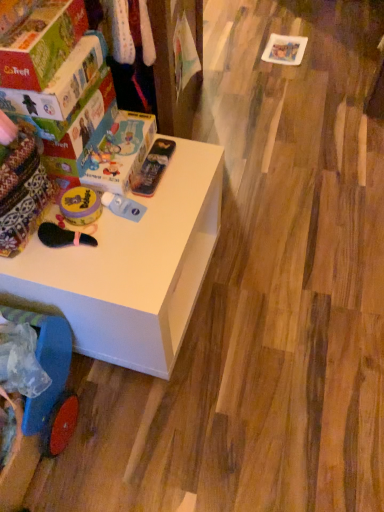
Question: Is metallic blue pencil case at upper center, which is the 1th toy in right-to-left order, a part of matte cardboard box at upper left, the 2th box positioned from the back?

Choices:
 (A) no
 (B) yes

Answer: (A)

Question: Is matte cardboard box at upper left, the 2th box positioned from the back, outside of metallic blue pencil case at upper center, which is the 1th toy in right-to-left order?

Choices:
 (A) yes
 (B) no

Answer: (A)

Question: Can you confirm if matte cardboard box at upper left, the 2th box positioned from the back, is positioned to the right of metallic blue pencil case at upper center, which is the 1th toy in right-to-left order?

Choices:
 (A) no
 (B) yes

Answer: (A)

Question: Is matte cardboard box at upper left, the 2th box positioned from the back, facing towards metallic blue pencil case at upper center, the third toy from the left?

Choices:
 (A) no
 (B) yes

Answer: (A)

Question: From the image's perspective, is matte cardboard box at upper left, which is counted as the first box, starting from the front, located above metallic blue pencil case at upper center, which is the 1th toy in right-to-left order?

Choices:
 (A) no
 (B) yes

Answer: (B)

Question: Is matte cardboard box at upper left, the 2th box positioned from the back, thinner than metallic blue pencil case at upper center, which is the 1th toy in right-to-left order?

Choices:
 (A) no
 (B) yes

Answer: (A)

Question: Is matte cardboard box at upper left, which is counted as the first box, starting from the front, completely or partially inside matte cardboard box at upper left, arranged as the second box when viewed from the front?

Choices:
 (A) yes
 (B) no

Answer: (B)

Question: From the image's perspective, is matte cardboard box at upper left, the first box from the back, on top of matte cardboard box at upper left, the 2th box positioned from the back?

Choices:
 (A) no
 (B) yes

Answer: (A)

Question: Can you confirm if matte cardboard box at upper left, arranged as the second box when viewed from the front, is taller than matte cardboard box at upper left, which is counted as the first box, starting from the front?

Choices:
 (A) yes
 (B) no

Answer: (B)

Question: Considering the relative sizes of matte cardboard box at upper left, the first box from the back, and matte cardboard box at upper left, the 2th box positioned from the back, in the image provided, is matte cardboard box at upper left, the first box from the back, thinner than matte cardboard box at upper left, the 2th box positioned from the back,?

Choices:
 (A) yes
 (B) no

Answer: (B)

Question: From the image's perspective, is matte cardboard box at upper left, arranged as the second box when viewed from the front, located beneath matte cardboard box at upper left, which is counted as the first box, starting from the front?

Choices:
 (A) yes
 (B) no

Answer: (A)

Question: Is matte cardboard box at upper left, the first box from the back, oriented away from matte cardboard box at upper left, the 2th box positioned from the back?

Choices:
 (A) yes
 (B) no

Answer: (B)

Question: Is the depth of metallic blue pencil case at upper center, the third toy from the left, greater than that of blue plastic baby carriage at lower left?

Choices:
 (A) no
 (B) yes

Answer: (B)